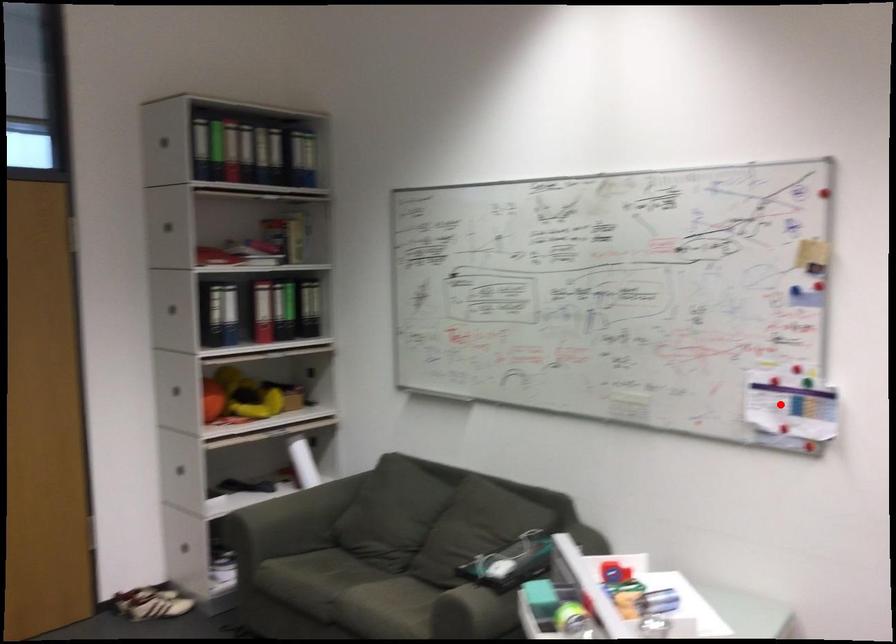
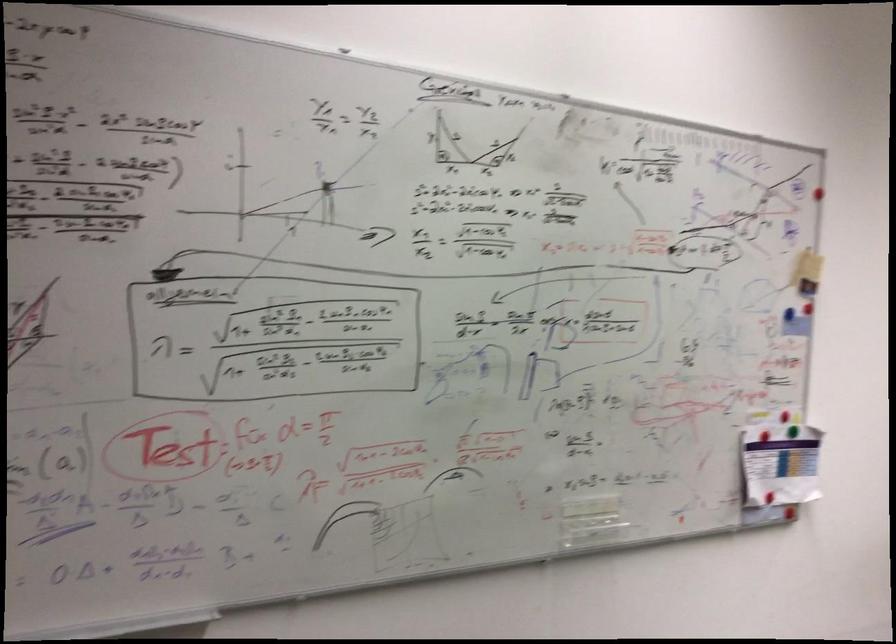
In the second image, find the point that corresponds to the highlighted location in the first image.

(780, 464)